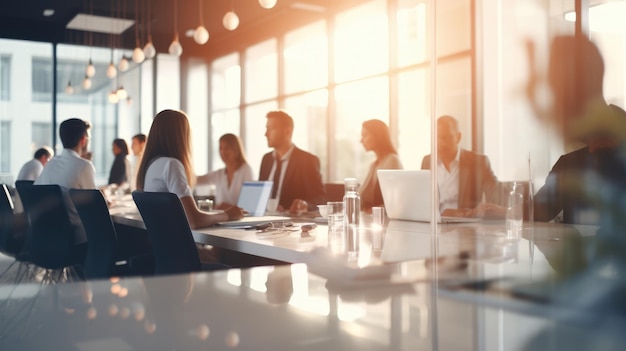
The width and height of the screenshot is (626, 351). What are the coordinates of `chairs` in the screenshot? It's located at (4, 196), (23, 186), (43, 205), (99, 208), (170, 228).